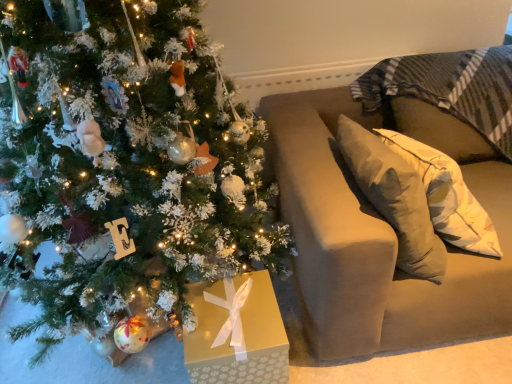
Question: In terms of height, does velvet beige sofa at right look taller or shorter compared to white frosted christmas tree at left?

Choices:
 (A) short
 (B) tall

Answer: (A)

Question: Visually, is velvet beige sofa at right positioned to the left or to the right of white frosted christmas tree at left?

Choices:
 (A) right
 (B) left

Answer: (A)

Question: Considering their positions, is velvet beige sofa at right located in front of or behind white frosted christmas tree at left?

Choices:
 (A) behind
 (B) front

Answer: (A)

Question: Is point (162, 67) positioned closer to the camera than point (305, 163)?

Choices:
 (A) closer
 (B) farther

Answer: (A)

Question: Would you say white frosted christmas tree at left is to the left or to the right of velvet beige sofa at right in the picture?

Choices:
 (A) left
 (B) right

Answer: (A)

Question: Looking at their shapes, would you say white frosted christmas tree at left is wider or thinner than velvet beige sofa at right?

Choices:
 (A) wide
 (B) thin

Answer: (A)

Question: From the image's perspective, is white frosted christmas tree at left above or below velvet beige sofa at right?

Choices:
 (A) below
 (B) above

Answer: (B)